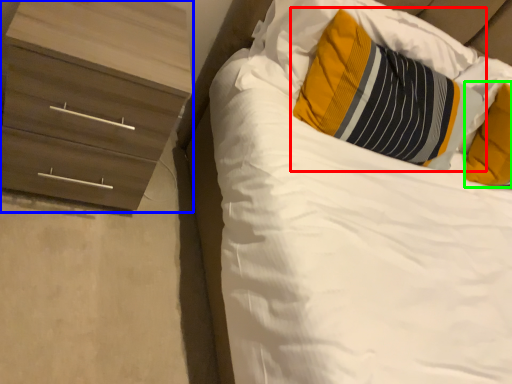
Question: Which object is positioned farthest from pillow (highlighted by a red box)? Select from chest of drawers (highlighted by a blue box) and pillow (highlighted by a green box).

Choices:
 (A) chest of drawers
 (B) pillow

Answer: (A)